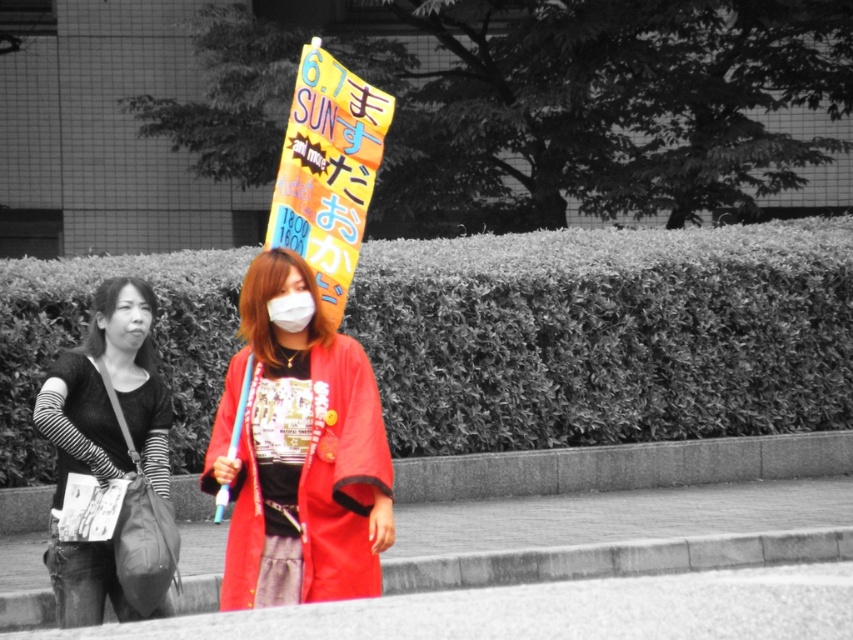
Is matte red kimono at center further to camera compared to striped fabric sweater at left?

No, it is not.

Who is higher up, matte red kimono at center or striped fabric sweater at left?

matte red kimono at center

Which is behind, point (384, 470) or point (51, 538)?

The point (51, 538) is more distant.

This screenshot has height=640, width=853. In order to click on matte red kimono at center in this screenshot , I will do `click(300, 456)`.

Can you confirm if striped fabric sweater at left is thinner than bright orange paper sign at center?

Incorrect, striped fabric sweater at left's width is not less than bright orange paper sign at center's.

Does striped fabric sweater at left have a smaller size compared to bright orange paper sign at center?

Correct, striped fabric sweater at left occupies less space than bright orange paper sign at center.

Identify the location of striped fabric sweater at left. (103, 440).

Can you confirm if matte red kimono at center is shorter than white matte mask at center?

Incorrect, matte red kimono at center's height does not fall short of white matte mask at center's.

Who is more forward, (390, 541) or (276, 314)?

Point (390, 541) is more forward.

Identify the location of matte red kimono at center. Image resolution: width=853 pixels, height=640 pixels. (300, 456).